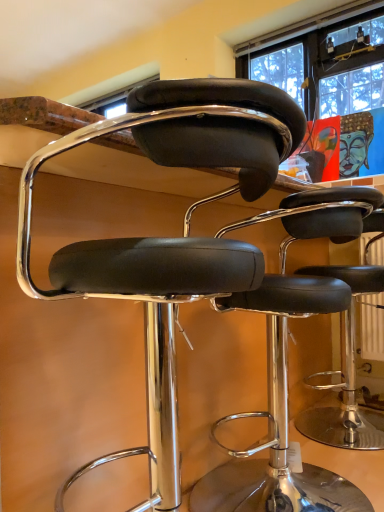
Question: From a real-world perspective, is black leather stool at center, the second chair from the back, above or below black leather stool at center, marked as the second chair in a front-to-back arrangement?

Choices:
 (A) above
 (B) below

Answer: (A)

Question: Is black leather stool at center, the second chair from the back, wider or thinner than black leather stool at center, marked as the second chair in a front-to-back arrangement?

Choices:
 (A) wide
 (B) thin

Answer: (A)

Question: Does point (254, 116) appear closer or farther from the camera than point (340, 202)?

Choices:
 (A) closer
 (B) farther

Answer: (A)

Question: Do you think black leather stool at center, marked as the second chair in a front-to-back arrangement, is within black leather stool at center, the second chair from the back, or outside of it?

Choices:
 (A) outside
 (B) inside

Answer: (B)

Question: Considering the positions of black leather stool at center, which appears as the 1th chair when viewed from the back, and black leather stool at center, the first chair from the front, in the image, is black leather stool at center, which appears as the 1th chair when viewed from the back, taller or shorter than black leather stool at center, the first chair from the front,?

Choices:
 (A) short
 (B) tall

Answer: (A)

Question: From the image's perspective, relative to black leather stool at center, the first chair from the front, is black leather stool at center, which appears as the 1th chair when viewed from the back, above or below?

Choices:
 (A) above
 (B) below

Answer: (B)

Question: Looking at the image, does black leather stool at center, marked as the second chair in a front-to-back arrangement, seem bigger or smaller compared to black leather stool at center, the second chair from the back?

Choices:
 (A) small
 (B) big

Answer: (A)